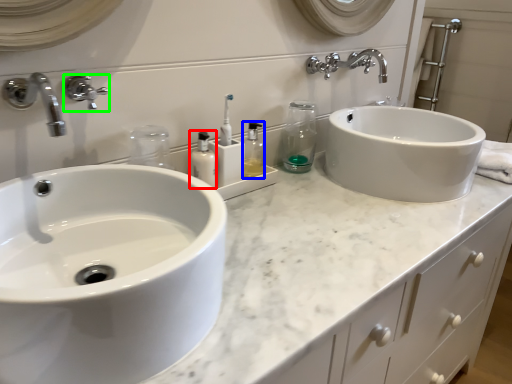
Question: Which is nearer to the mouthwash (highlighted by a red box)? toiletry (highlighted by a blue box) or tap (highlighted by a green box).

Choices:
 (A) toiletry
 (B) tap

Answer: (A)